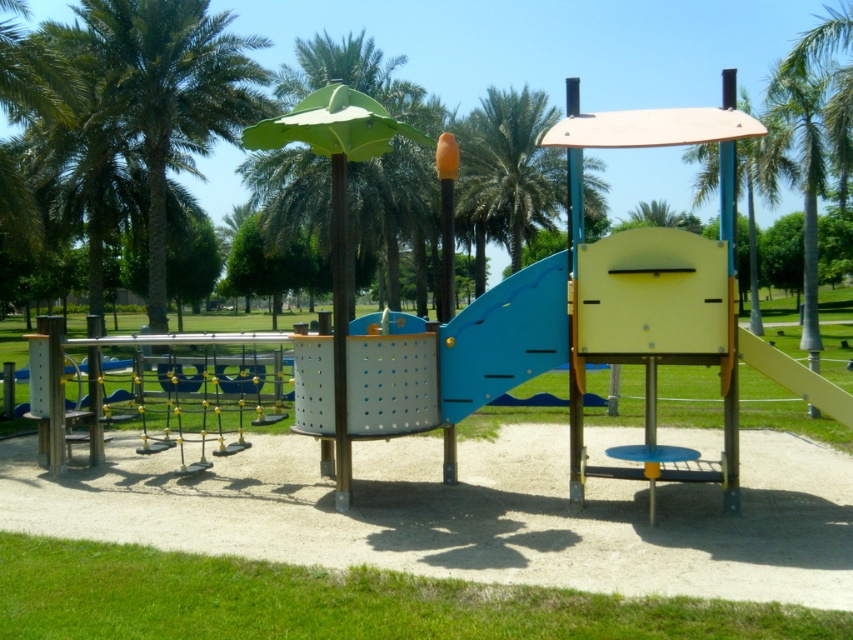
Is green leafy umbrella at center taller than green leafy palm tree at upper center?

No.

Can you confirm if green leafy umbrella at center is smaller than green leafy palm tree at upper center?

Yes.

Is point (347, 112) positioned behind point (704, 168)?

No.

Locate an element on the screen. green leafy umbrella at center is located at coordinates (334, 125).

Who is higher up, green leafy palm tree at upper left or green leafy palm tree at upper right?

green leafy palm tree at upper right

Which is behind, point (183, 42) or point (809, 259)?

Positioned behind is point (809, 259).

Is point (128, 12) positioned in front of point (770, 120)?

Yes, point (128, 12) is in front of point (770, 120).

Locate an element on the screen. The height and width of the screenshot is (640, 853). green leafy palm tree at upper left is located at coordinates (172, 93).

Which is below, green leafy palm tree at center or green leafy palm tree at upper right?

green leafy palm tree at upper right is below.

Consider the image. Who is more distant from viewer, (531,152) or (795,116)?

The point (531,152) is behind.

Is point (498, 148) more distant than point (798, 104)?

Yes, it is.

At what (x,y) coordinates should I click in order to perform the action: click on green leafy palm tree at center. Please return your answer as a coordinate pair (x, y). Looking at the image, I should click on (509, 166).